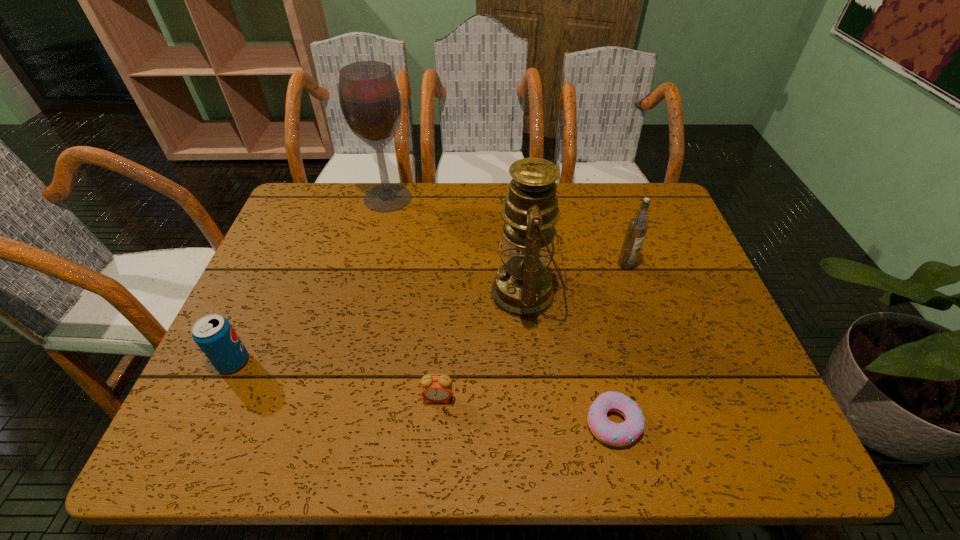
The width and height of the screenshot is (960, 540). In order to click on the second object from left to right in this screenshot , I will do `click(369, 96)`.

Where is `alcohol`? The width and height of the screenshot is (960, 540). alcohol is located at coordinates (369, 96).

The width and height of the screenshot is (960, 540). Find the location of `the third object from right to left`. the third object from right to left is located at coordinates (522, 288).

In order to click on the rightmost object in this screenshot , I will do `click(637, 228)`.

Locate an element on the screen. Image resolution: width=960 pixels, height=540 pixels. vodka is located at coordinates (637, 228).

Identify the location of the third shortest object. (214, 335).

Where is `the third nearest object`? This screenshot has height=540, width=960. the third nearest object is located at coordinates (214, 335).

Identify the location of alarm clock. The height and width of the screenshot is (540, 960). (437, 389).

The image size is (960, 540). I want to click on the second shortest object, so click(437, 389).

I want to click on the second object from right to left, so click(622, 434).